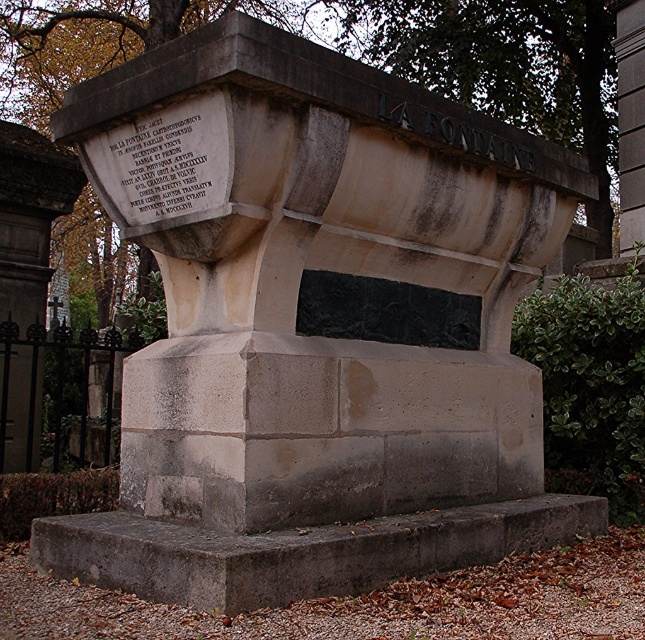
Question: Which object is farther from the camera taking this photo?

Choices:
 (A) brown stone sign at upper center
 (B) gray stone monument at center

Answer: (A)

Question: Which of the following is the farthest from the observer?

Choices:
 (A) gray stone monument at center
 (B) black stone inscription at upper left
 (C) brown stone sign at upper center

Answer: (C)

Question: In this image, where is brown stone sign at upper center located relative to black stone inscription at upper left?

Choices:
 (A) left
 (B) right

Answer: (B)

Question: Based on their relative distances, which object is farther from the brown stone sign at upper center?

Choices:
 (A) black stone inscription at upper left
 (B) gray stone monument at center

Answer: (A)

Question: Can you confirm if gray stone monument at center is positioned above brown stone sign at upper center?

Choices:
 (A) no
 (B) yes

Answer: (A)

Question: Does brown stone sign at upper center appear under black stone inscription at upper left?

Choices:
 (A) no
 (B) yes

Answer: (A)